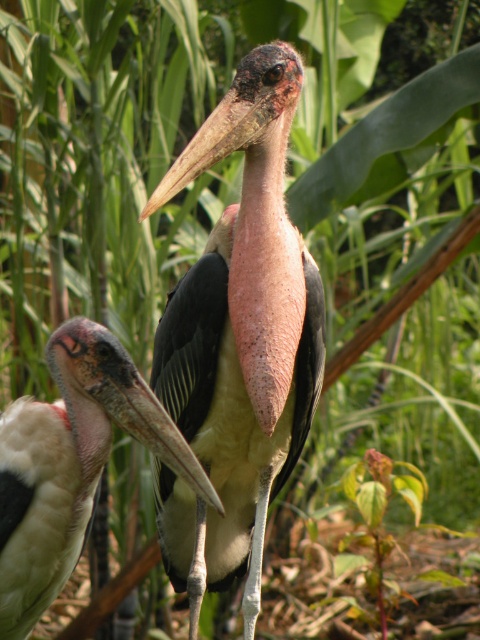
Question: Where is speckled pinkish-brown marabou stork at center located in relation to light brown feathered bird at center in the image?

Choices:
 (A) below
 (B) above

Answer: (B)

Question: Is speckled pinkish-brown marabou stork at center bigger than light brown feathered bird at center?

Choices:
 (A) yes
 (B) no

Answer: (A)

Question: Is speckled pinkish-brown marabou stork at center bigger than light brown feathered bird at center?

Choices:
 (A) no
 (B) yes

Answer: (B)